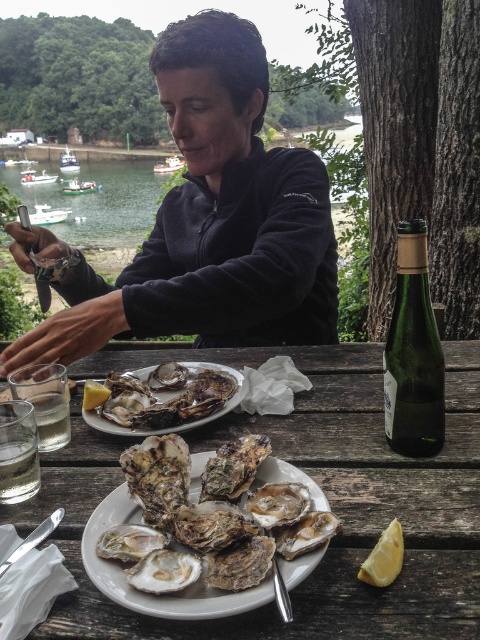
Question: Which point is farther from the camera taking this photo?

Choices:
 (A) (41, 438)
 (B) (101, 397)

Answer: (B)

Question: Estimate the real-world distances between objects in this image. Which object is farther from the clear glass water at lower left?

Choices:
 (A) green glass bottle at center-right
 (B) yellow matte lemon at lower right
 (C) shiny silver oyster at center
 (D) clear water at upper left

Answer: (D)

Question: Does dark blue fleece at center have a smaller size compared to yellow matte lemon at center?

Choices:
 (A) yes
 (B) no

Answer: (B)

Question: Among these objects, which one is nearest to the camera?

Choices:
 (A) clear glass at lower left
 (B) green glass bottle at center-right
 (C) yellow matte lemon at center
 (D) dark blue fleece at center

Answer: (B)

Question: Is the position of dark blue fleece at center less distant than that of clear glass at lower left?

Choices:
 (A) yes
 (B) no

Answer: (B)

Question: Can you confirm if white ceramic plate at center is thinner than clear water at upper left?

Choices:
 (A) yes
 (B) no

Answer: (A)